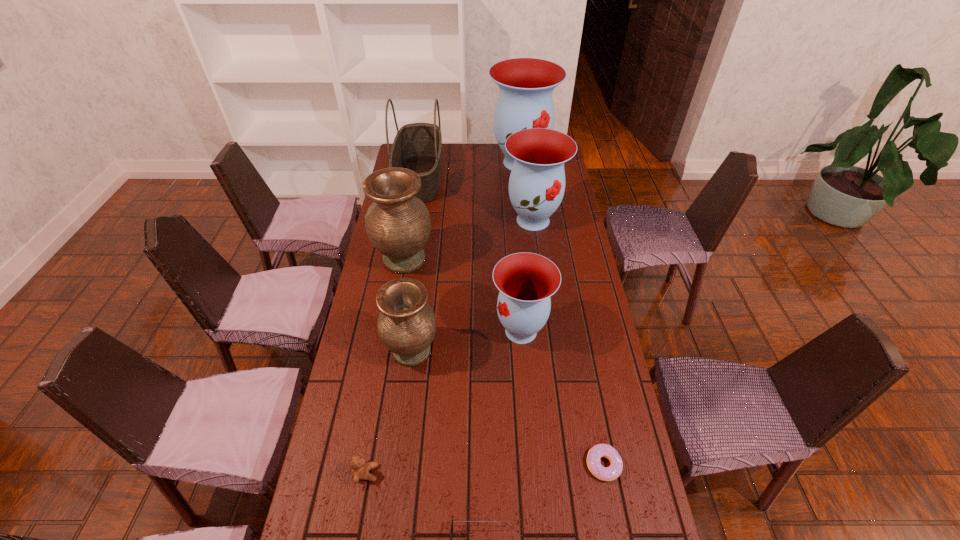
Where is `vacant region between the tallest object and the bigger green vase`? vacant region between the tallest object and the bigger green vase is located at coordinates (463, 211).

I want to click on vacant space that's between the bigger green vase and the teddy bear, so click(385, 366).

Locate an element on the screen. The width and height of the screenshot is (960, 540). object that stands as the closest to the farther green vase is located at coordinates point(418,146).

Locate an element on the screen. the eighth closest object to the nearest object is located at coordinates (526, 85).

Find the location of `vase that is the third nearest to the nearer green vase`. vase that is the third nearest to the nearer green vase is located at coordinates (537, 181).

Select which vase is the fourth closest to the second smallest red vase. Please provide its 2D coordinates. Your answer should be formatted as a tuple, i.e. [(x, y)], where the tuple contains the x and y coordinates of a point satisfying the conditions above.

[(406, 325)]

Locate which red vase is the second closest to the biggest red vase. Please provide its 2D coordinates. Your answer should be formatted as a tuple, i.e. [(x, y)], where the tuple contains the x and y coordinates of a point satisfying the conditions above.

[(526, 281)]

The height and width of the screenshot is (540, 960). I want to click on the closest red vase to the farthest vase, so click(537, 181).